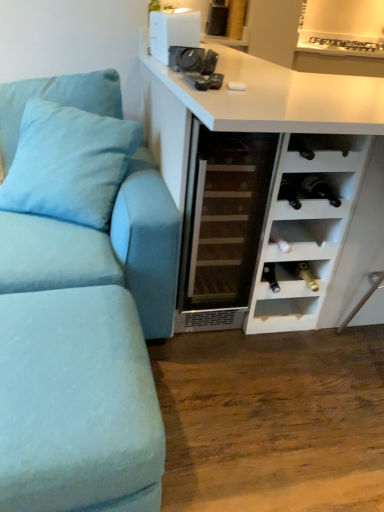
Question: Considering the relative positions of white matte wine rack at right, the fourth shelf ordered from the bottom, and light blue fabric pillow at left in the image provided, is white matte wine rack at right, the fourth shelf ordered from the bottom, to the left of light blue fabric pillow at left from the viewer's perspective?

Choices:
 (A) yes
 (B) no

Answer: (B)

Question: Is the position of white matte wine rack at right, the fourth shelf ordered from the bottom, less distant than that of light blue fabric pillow at left?

Choices:
 (A) yes
 (B) no

Answer: (A)

Question: Does white matte wine rack at right, placed as the 1th shelf when sorted from top to bottom, have a lesser height compared to light blue fabric pillow at left?

Choices:
 (A) yes
 (B) no

Answer: (A)

Question: Is white matte wine rack at right, placed as the 1th shelf when sorted from top to bottom, bigger than light blue fabric pillow at left?

Choices:
 (A) yes
 (B) no

Answer: (B)

Question: Is white matte wine rack at right, placed as the 1th shelf when sorted from top to bottom, positioned far away from light blue fabric pillow at left?

Choices:
 (A) no
 (B) yes

Answer: (A)

Question: Based on their sizes in the image, would you say black matte wine bottle at lower right, which appears as the first shelf when ordered from the bottom, is bigger or smaller than light blue fabric couch at left?

Choices:
 (A) small
 (B) big

Answer: (A)

Question: In the image, is black matte wine bottle at lower right, which appears as the first shelf when ordered from the bottom, positioned in front of or behind light blue fabric couch at left?

Choices:
 (A) front
 (B) behind

Answer: (B)

Question: Would you say black matte wine bottle at lower right, which appears as the first shelf when ordered from the bottom, is inside or outside light blue fabric couch at left?

Choices:
 (A) outside
 (B) inside

Answer: (A)

Question: Is point (327, 260) closer or farther from the camera than point (94, 378)?

Choices:
 (A) closer
 (B) farther

Answer: (B)

Question: From a real-world perspective, relative to transparent glass wine cooler at center, is white plastic speaker at upper center vertically above or below?

Choices:
 (A) above
 (B) below

Answer: (A)

Question: Considering their positions, is white plastic speaker at upper center located in front of or behind transparent glass wine cooler at center?

Choices:
 (A) behind
 (B) front

Answer: (A)

Question: Choose the correct answer: Is white plastic speaker at upper center inside transparent glass wine cooler at center or outside it?

Choices:
 (A) outside
 (B) inside

Answer: (A)

Question: Considering the positions of white plastic speaker at upper center and transparent glass wine cooler at center in the image, is white plastic speaker at upper center taller or shorter than transparent glass wine cooler at center?

Choices:
 (A) short
 (B) tall

Answer: (A)

Question: Is light blue fabric couch at left bigger or smaller than black glass wine bottles at lower right, the 3th shelf when ordered from bottom to top?

Choices:
 (A) big
 (B) small

Answer: (A)

Question: Does point (130, 222) appear closer or farther from the camera than point (309, 187)?

Choices:
 (A) closer
 (B) farther

Answer: (A)